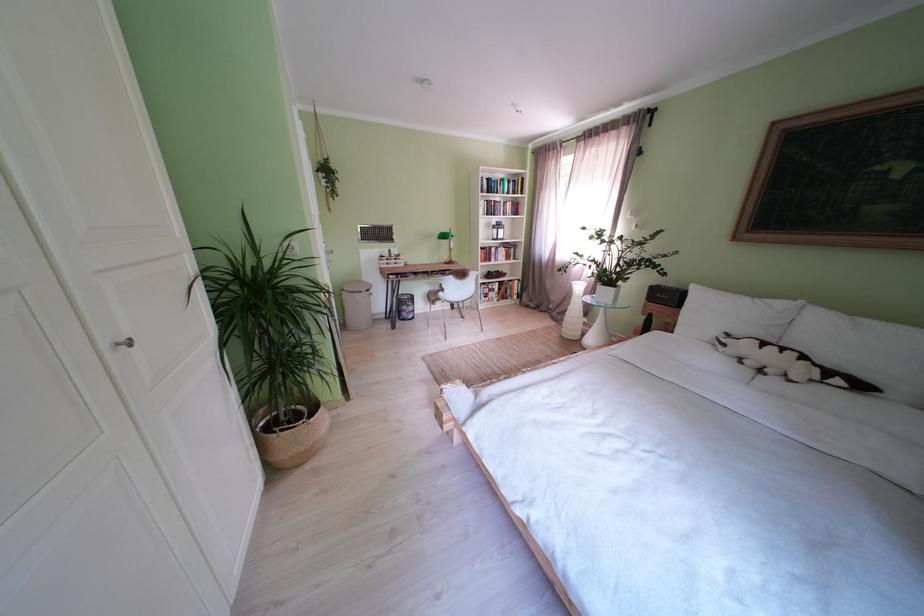
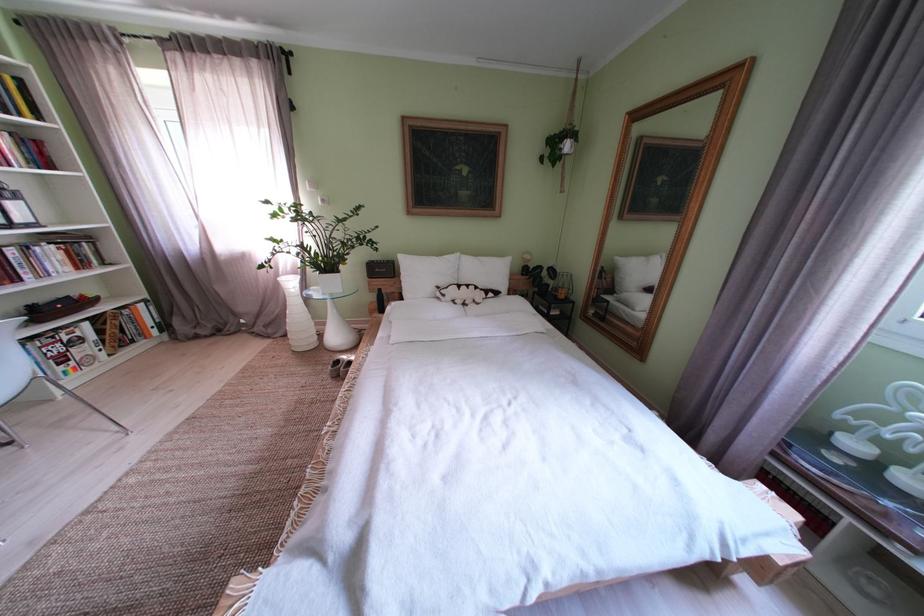
Locate, in the second image, the point that corresponds to the point at 528,188 in the first image.

(9, 92)